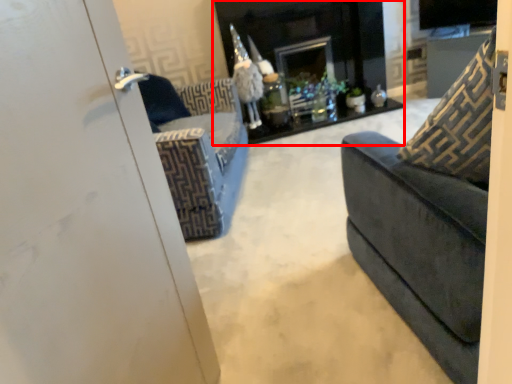
Question: From the image's perspective, what is the correct spatial relationship of fireplace (annotated by the red box) in relation to throw pillow?

Choices:
 (A) below
 (B) above

Answer: (B)